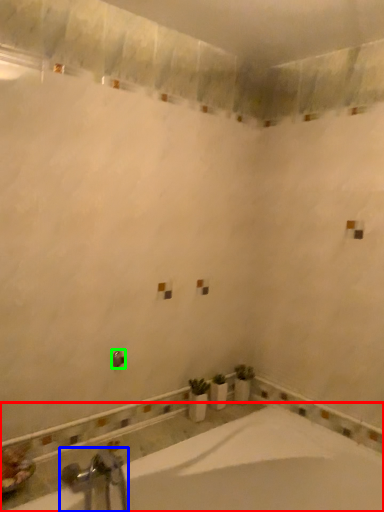
Question: Based on their relative distances, which object is farther from bathtub (highlighted by a red box)? Choose from tap (highlighted by a blue box) and shower (highlighted by a green box).

Choices:
 (A) tap
 (B) shower

Answer: (B)